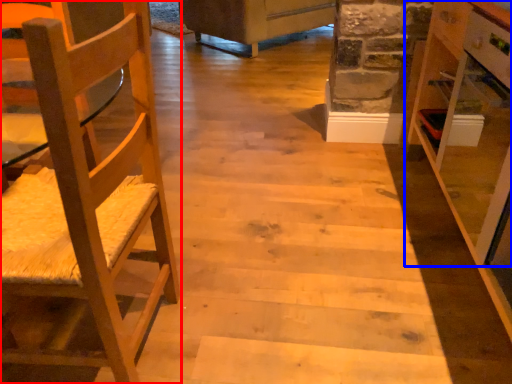
Question: Which of the following is the closest to the observer, chair (highlighted by a red box) or cabinetry (highlighted by a blue box)?

Choices:
 (A) chair
 (B) cabinetry

Answer: (A)